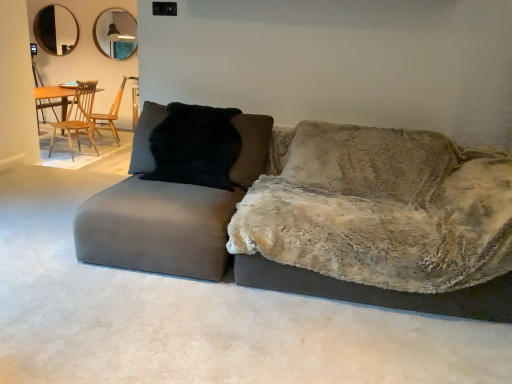
The image size is (512, 384). In order to click on vacant area in front of matte gray swivel chair at left in this screenshot , I will do `click(167, 320)`.